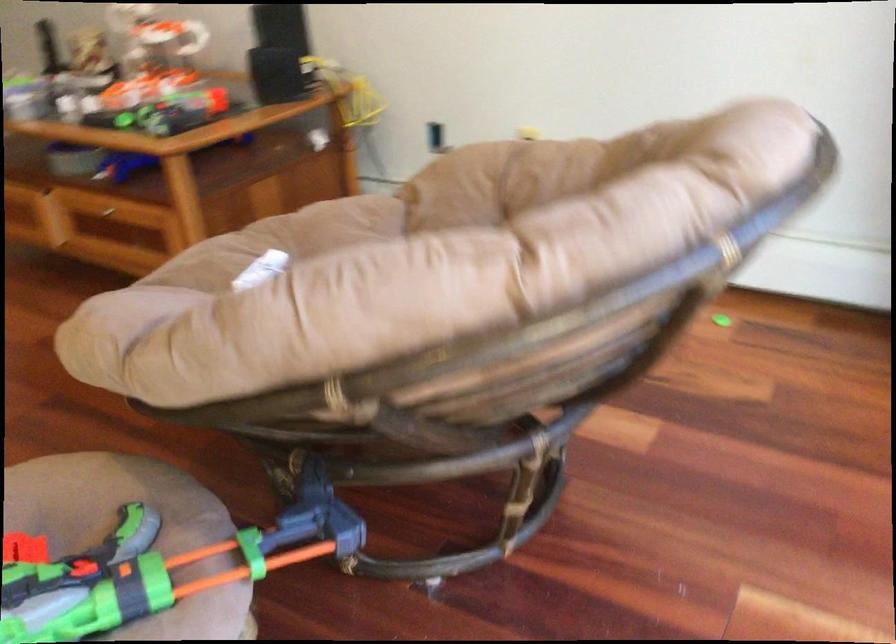
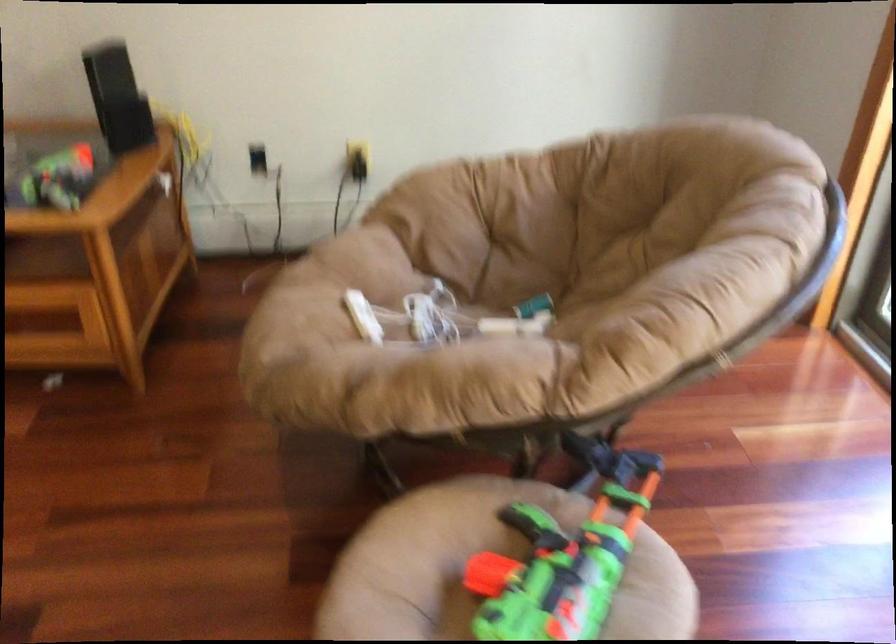
Where in the second image is the point corresponding to [176,191] from the first image?

(95, 263)